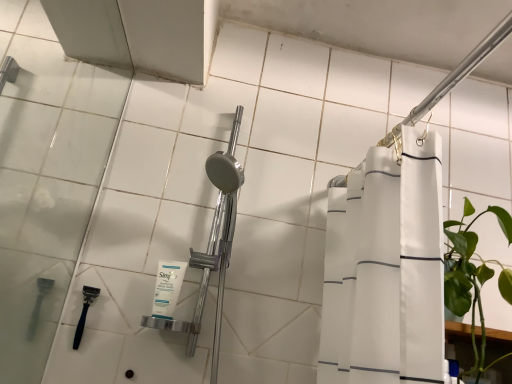
Question: Is the depth of white fabric shower curtain at upper right, the first shower in the top-to-bottom sequence, greater than that of white matte facial cleanser at center?

Choices:
 (A) yes
 (B) no

Answer: (B)

Question: From a real-world perspective, is white fabric shower curtain at upper right, the first shower in the top-to-bottom sequence, physically below white matte facial cleanser at center?

Choices:
 (A) yes
 (B) no

Answer: (B)

Question: From the image's perspective, is white fabric shower curtain at upper right, placed as the second shower when sorted from bottom to top, on white matte facial cleanser at center?

Choices:
 (A) yes
 (B) no

Answer: (A)

Question: Could you tell me if white fabric shower curtain at upper right, the first shower in the top-to-bottom sequence, is facing white matte facial cleanser at center?

Choices:
 (A) no
 (B) yes

Answer: (A)

Question: Would you say white fabric shower curtain at upper right, placed as the 1th shower when sorted from front to back, is outside white matte facial cleanser at center?

Choices:
 (A) no
 (B) yes

Answer: (B)

Question: Are white fabric shower curtain at upper right, placed as the 1th shower when sorted from front to back, and white matte facial cleanser at center located far from each other?

Choices:
 (A) no
 (B) yes

Answer: (A)

Question: Is white matte facial cleanser at center positioned far away from white fabric shower curtain at upper right, placed as the 1th shower when sorted from front to back?

Choices:
 (A) yes
 (B) no

Answer: (B)

Question: From the image's perspective, is white matte facial cleanser at center beneath white fabric shower curtain at upper right, placed as the 1th shower when sorted from front to back?

Choices:
 (A) no
 (B) yes

Answer: (B)

Question: From a real-world perspective, is white matte facial cleanser at center located higher than white fabric shower curtain at upper right, placed as the second shower when sorted from bottom to top?

Choices:
 (A) yes
 (B) no

Answer: (B)

Question: Is white matte facial cleanser at center turned away from white fabric shower curtain at upper right, which ranks as the first shower in right-to-left order?

Choices:
 (A) no
 (B) yes

Answer: (A)

Question: Is white matte facial cleanser at center thinner than white fabric shower curtain at upper right, arranged as the second shower when viewed from the left?

Choices:
 (A) yes
 (B) no

Answer: (A)

Question: Is white matte facial cleanser at center bigger than white fabric shower curtain at upper right, placed as the 1th shower when sorted from front to back?

Choices:
 (A) no
 (B) yes

Answer: (A)

Question: Does white matte facial cleanser at center have a lesser width compared to black plastic razor at lower left, positioned as the first shower in left-to-right order?

Choices:
 (A) no
 (B) yes

Answer: (A)